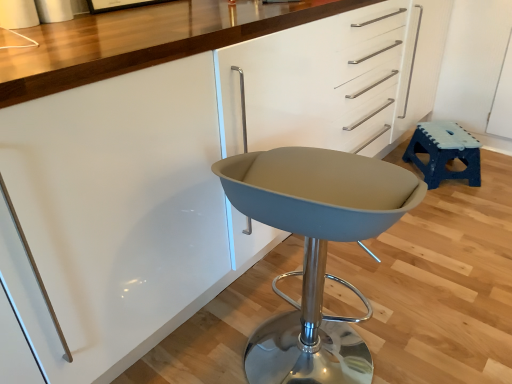
Question: In terms of height, does blue plastic stool at right look taller or shorter compared to matte gray swivel chair at center?

Choices:
 (A) tall
 (B) short

Answer: (B)

Question: In the image, is blue plastic stool at right on the left side or the right side of matte gray swivel chair at center?

Choices:
 (A) left
 (B) right

Answer: (B)

Question: Is blue plastic stool at right wider or thinner than matte gray swivel chair at center?

Choices:
 (A) wide
 (B) thin

Answer: (B)

Question: Is matte gray swivel chair at center spatially inside blue plastic stool at right, or outside of it?

Choices:
 (A) outside
 (B) inside

Answer: (A)

Question: From a real-world perspective, is matte gray swivel chair at center above or below blue plastic stool at right?

Choices:
 (A) below
 (B) above

Answer: (B)

Question: Considering the positions of matte gray swivel chair at center and blue plastic stool at right in the image, is matte gray swivel chair at center taller or shorter than blue plastic stool at right?

Choices:
 (A) tall
 (B) short

Answer: (A)

Question: Does point (359, 223) appear closer or farther from the camera than point (441, 150)?

Choices:
 (A) closer
 (B) farther

Answer: (A)